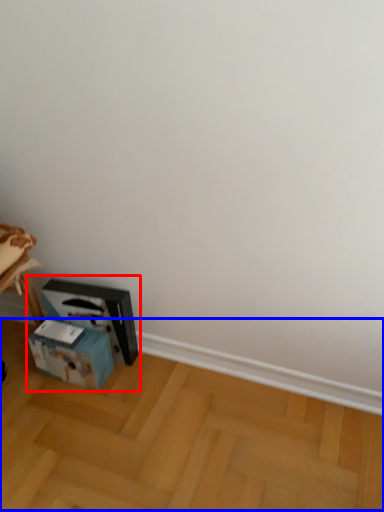
Question: Among these objects, which one is farthest to the camera, workbench (highlighted by a red box) or wood (highlighted by a blue box)?

Choices:
 (A) workbench
 (B) wood

Answer: (A)